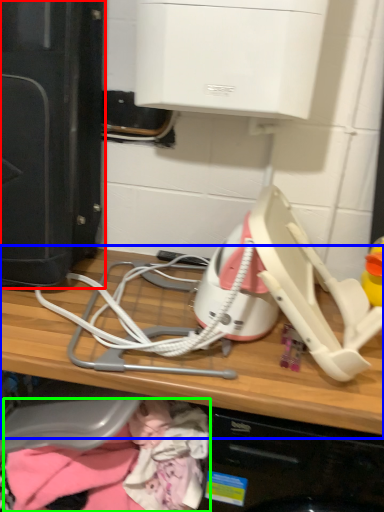
Question: Which object is the closest to the home appliance (highlighted by a red box)? Choose among these: computer (highlighted by a blue box) or clothing (highlighted by a green box).

Choices:
 (A) computer
 (B) clothing

Answer: (A)